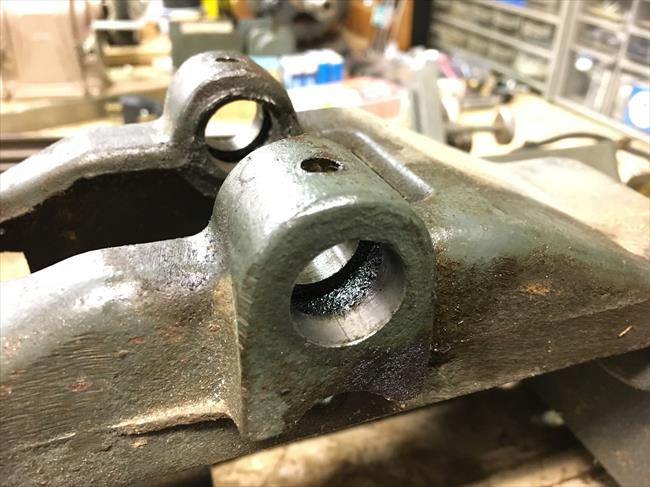
Find the location of a particular element. The image size is (650, 487). cabinet is located at coordinates (606, 53), (489, 33).